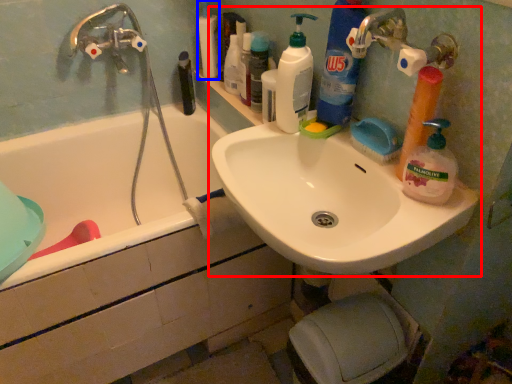
Question: Among these objects, which one is farthest to the camera, sink (highlighted by a red box) or toiletry (highlighted by a blue box)?

Choices:
 (A) sink
 (B) toiletry

Answer: (B)